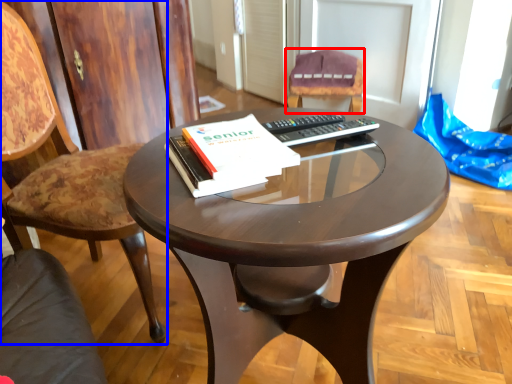
Question: Which of the following is the closest to the observer, chair (highlighted by a red box) or chair (highlighted by a blue box)?

Choices:
 (A) chair
 (B) chair

Answer: (B)